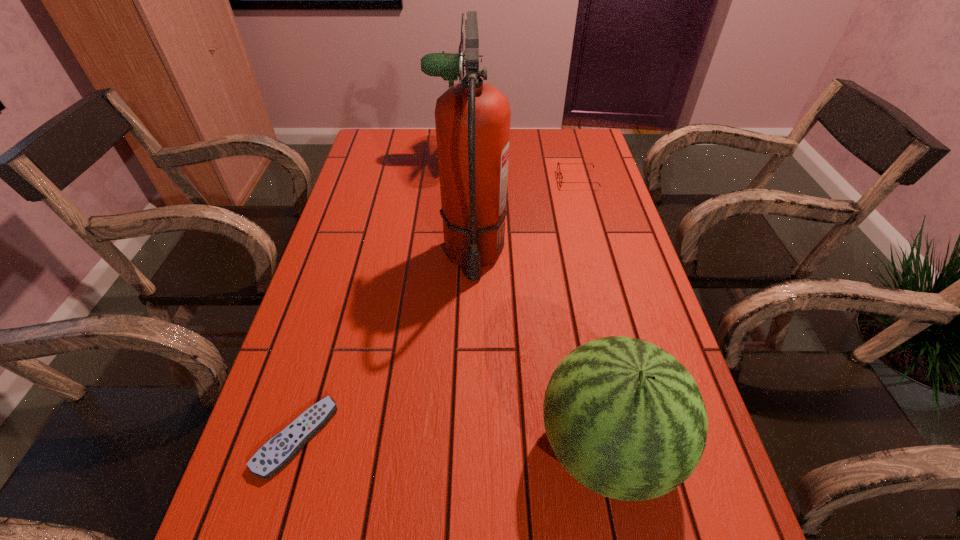
Choose which object is the fourth nearest neighbor to the tallest object. Please provide its 2D coordinates. Your answer should be formatted as a tuple, i.e. [(x, y)], where the tuple contains the x and y coordinates of a point satisfying the conditions above.

[(278, 451)]

Where is `object identified as the third closest to the remote control`? object identified as the third closest to the remote control is located at coordinates (434, 64).

Identify the location of vacant space that satisfies the following two spatial constraints: 1. on the front-facing side of the sunglasses; 2. on the front side of the third tallest object. (650, 448).

Identify the location of vacant space that satisfies the following two spatial constraints: 1. on the front-facing side of the fan; 2. on the front side of the leftmost object. This screenshot has height=540, width=960. (432, 437).

Image resolution: width=960 pixels, height=540 pixels. What are the coordinates of `vacant space that satisfies the following two spatial constraints: 1. on the front-facing side of the fourth shortest object; 2. on the right side of the third tallest object` in the screenshot? It's located at (431, 448).

In order to click on free region that satisfies the following two spatial constraints: 1. on the front side of the watermelon; 2. on the right side of the leftmost object in this screenshot , I will do `click(293, 448)`.